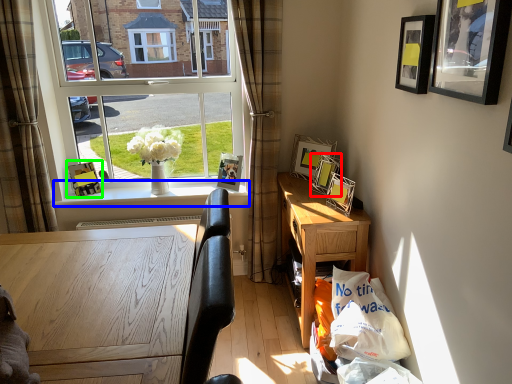
Question: Which object is the farthest from picture frame (highlighted by a red box)? Choose among these: window sill (highlighted by a blue box) or picture frame (highlighted by a green box).

Choices:
 (A) window sill
 (B) picture frame

Answer: (B)